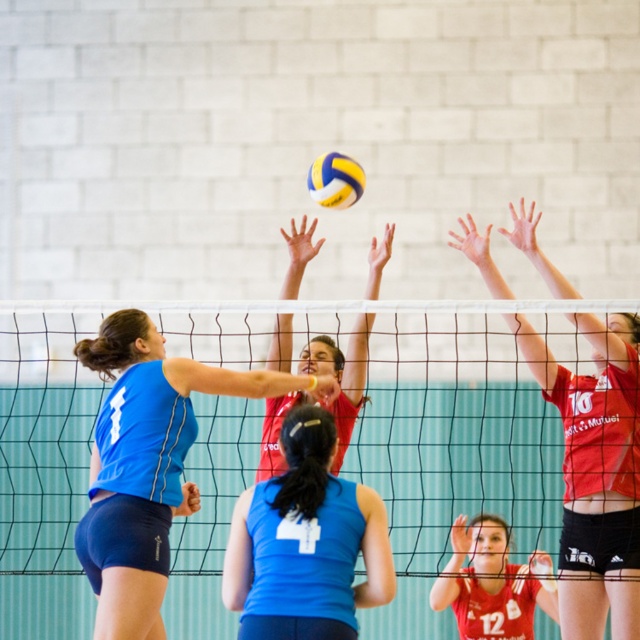
Question: Does black mesh net at center appear under yellowleather-likevolleyball at center?

Choices:
 (A) yes
 (B) no

Answer: (A)

Question: Considering the real-world distances, which object is closest to the blue jersey at center?

Choices:
 (A) blue matte tank top at center
 (B) black mesh net at center
 (C) matte red jersey at center

Answer: (A)

Question: Among these objects, which one is farthest from the camera?

Choices:
 (A) blue matte tank top at center
 (B) black mesh net at center
 (C) yellowleather-likevolleyball at center
 (D) matte red jersey at upper center

Answer: (B)

Question: Which object is the closest to the yellowleather-likevolleyball at center?

Choices:
 (A) matte red jersey at upper center
 (B) matte red volleyball at center

Answer: (B)

Question: Is the position of matte red jersey at upper center less distant than that of matte red jersey at center?

Choices:
 (A) yes
 (B) no

Answer: (A)

Question: Is blue jersey at center in front of matte red jersey at upper center?

Choices:
 (A) yes
 (B) no

Answer: (A)